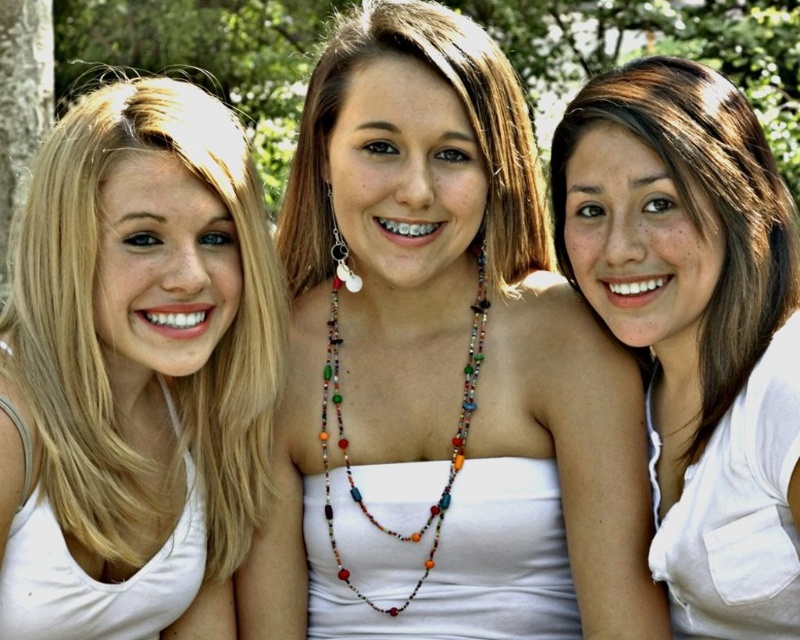
Does white matte tank top at center have a greater height compared to multicolored beaded necklace at center?

Correct, white matte tank top at center is much taller as multicolored beaded necklace at center.

Does point (488, 230) come in front of point (458, 438)?

No, (488, 230) is further to viewer.

Measure the distance between point (420, 349) and camera.

Point (420, 349) and camera are 4.85 meters apart.

Find the location of `white matte tank top at center`. white matte tank top at center is located at coordinates (440, 371).

Who is taller, white matte tank top at center or blonde hair at left?

white matte tank top at center is taller.

Which is below, white matte tank top at center or blonde hair at left?

blonde hair at left

Is point (420, 262) positioned in front of point (244, 195)?

No, it is not.

The width and height of the screenshot is (800, 640). I want to click on white matte tank top at center, so click(x=440, y=371).

Who is taller, white matte shirt at right or multicolored beaded necklace at center?

Standing taller between the two is white matte shirt at right.

Does point (652, 424) come farther from viewer compared to point (337, 378)?

No.

Is point (672, 401) farther from viewer compared to point (324, 380)?

That is False.

This screenshot has width=800, height=640. In order to click on white matte shirt at right in this screenshot , I will do `click(696, 324)`.